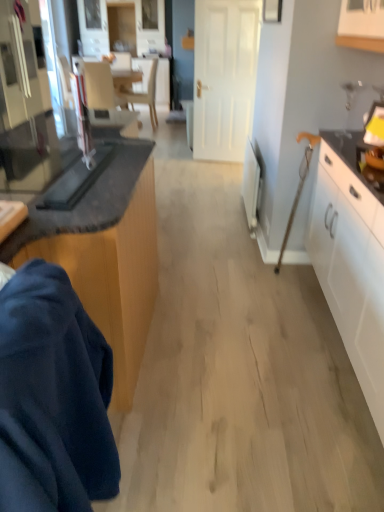
Question: Looking at their shapes, would you say black glass toaster at left, the second appliance in the back-to-front sequence, is wider or thinner than matte gray armchair at upper left?

Choices:
 (A) wide
 (B) thin

Answer: (A)

Question: Considering the positions of black glass toaster at left, acting as the first appliance starting from the left, and matte gray armchair at upper left in the image, is black glass toaster at left, acting as the first appliance starting from the left, taller or shorter than matte gray armchair at upper left?

Choices:
 (A) tall
 (B) short

Answer: (B)

Question: Based on their relative distances, which object is nearer to the light beige wood chair at upper center?

Choices:
 (A) white plastic radiator at right, which is the first appliance from right to left
 (B) dark blue fabric at lower left
 (C) white matte door at center
 (D) wooden cabinet at lower left, which appears as the 2th cabinetry when viewed from the right
 (E) black glass toaster at left, the 1th appliance from the front

Answer: (C)

Question: Which object is positioned closest to the black glass toaster at left, which appears as the 2th appliance when viewed from the right?

Choices:
 (A) wooden cabinet at lower left, which appears as the 2th cabinetry when viewed from the right
 (B) matte gray armchair at upper left
 (C) dark blue fabric at lower left
 (D) white plastic radiator at right, the 2th appliance from the front
 (E) light beige wood chair at upper center

Answer: (A)